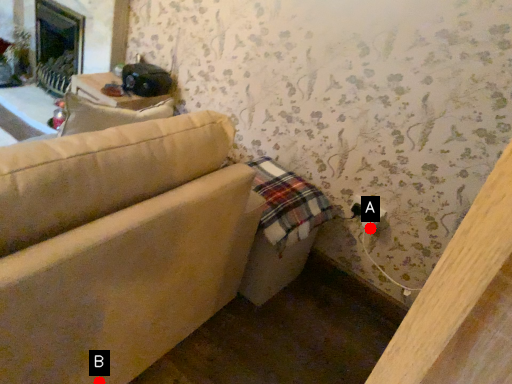
Question: Two points are circled on the image, labeled by A and B beside each circle. Among these points, which one is farthest from the camera?

Choices:
 (A) A is further
 (B) B is further

Answer: (A)